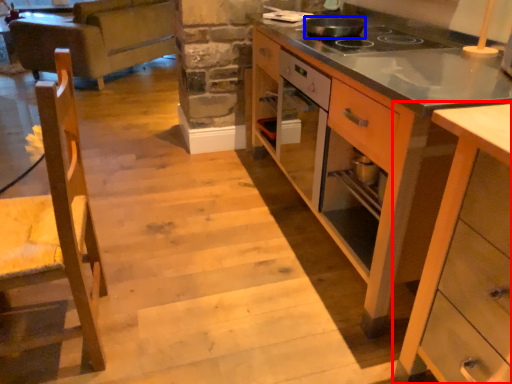
Question: Which object appears closest to the camera in this image, cabinetry (highlighted by a red box) or kitchen appliance (highlighted by a blue box)?

Choices:
 (A) cabinetry
 (B) kitchen appliance

Answer: (A)